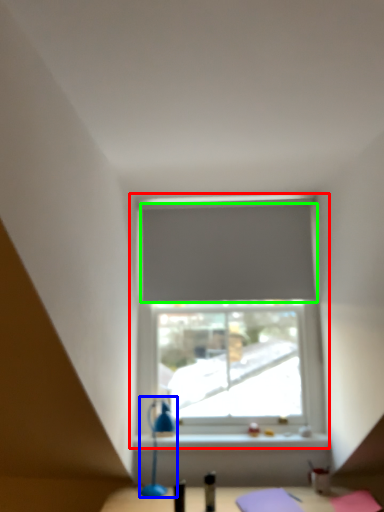
Question: Which is farther away from window (highlighted by a red box)? table lamp (highlighted by a blue box) or curtain (highlighted by a green box)?

Choices:
 (A) table lamp
 (B) curtain

Answer: (A)